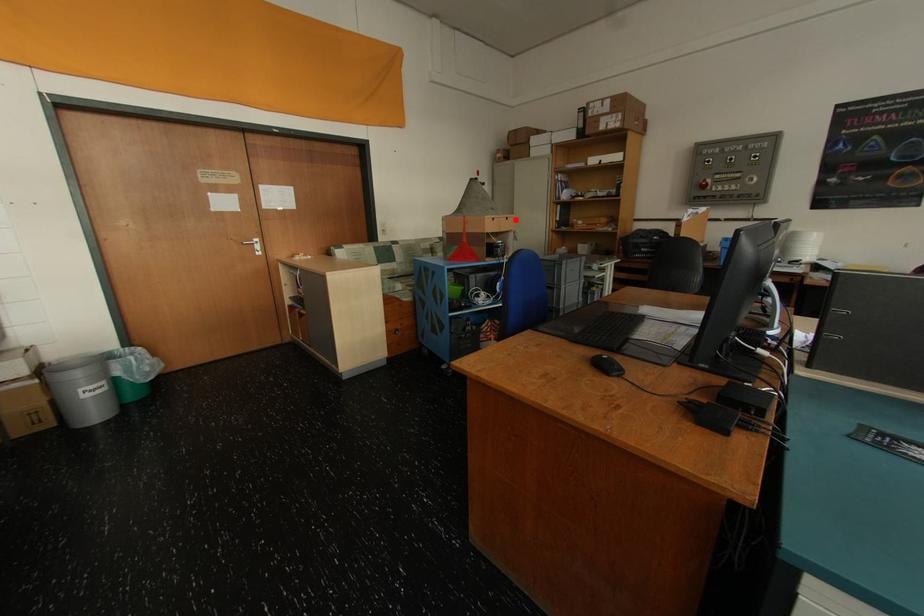
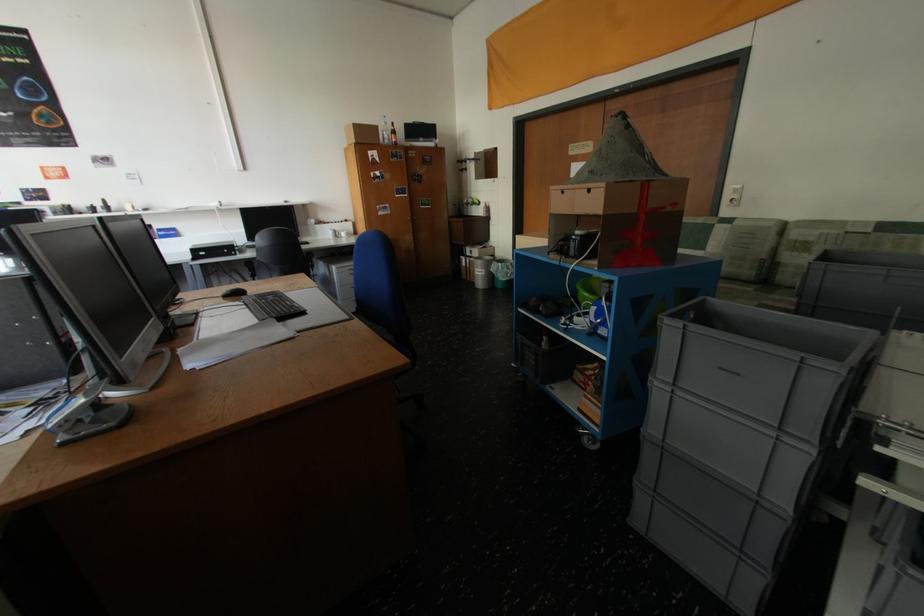
The point at the highlighted location is marked in the first image. Where is the corresponding point in the second image?

(598, 192)